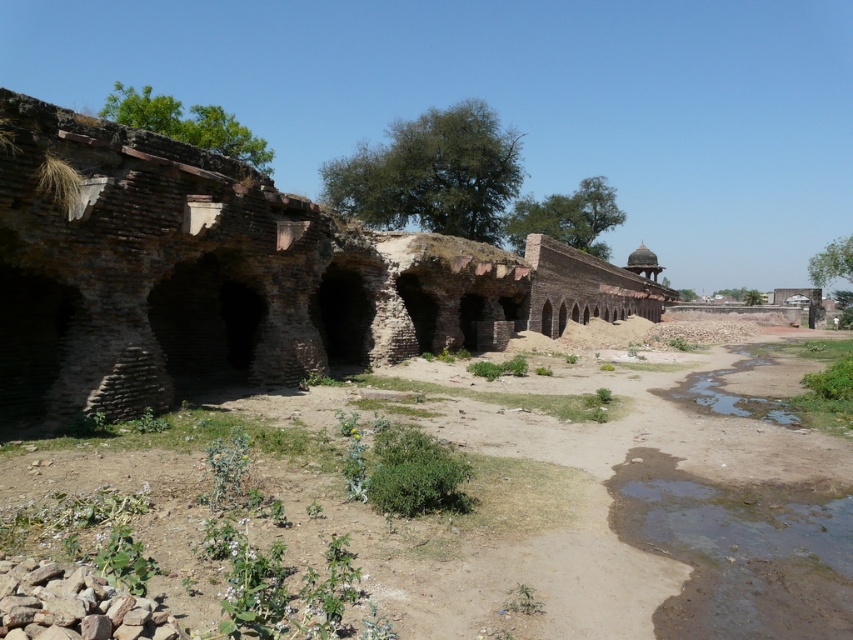
Looking at this image, is brown sandy dirt field at center to the right of brown brick ruins at center from the viewer's perspective?

Incorrect, brown sandy dirt field at center is not on the right side of brown brick ruins at center.

Identify the location of brown sandy dirt field at center. Image resolution: width=853 pixels, height=640 pixels. (576, 513).